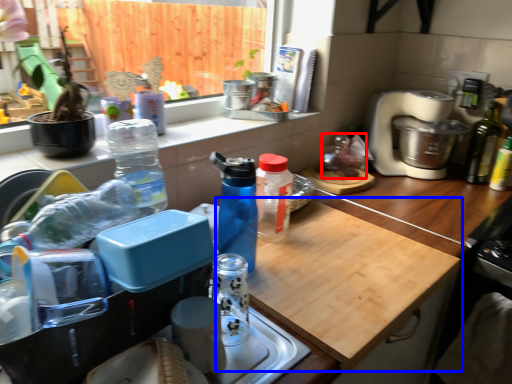
Question: Which object appears farthest to the camera in this image, food (highlighted by a red box) or cutting board (highlighted by a blue box)?

Choices:
 (A) food
 (B) cutting board

Answer: (A)